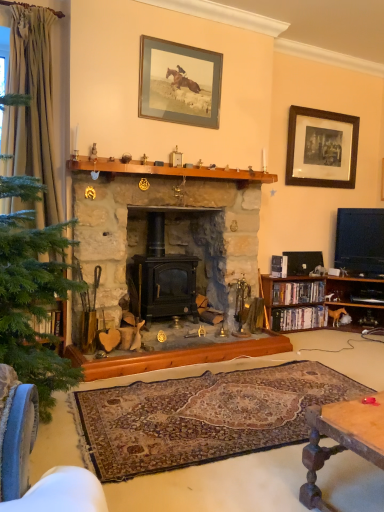
Question: Is black wood picture frame at upper right, which ranks as the first picture frame in right-to-left order, bigger or smaller than black stone fireplace at center?

Choices:
 (A) small
 (B) big

Answer: (A)

Question: Considering the positions of point (342, 120) and point (137, 162), is point (342, 120) closer or farther from the camera than point (137, 162)?

Choices:
 (A) closer
 (B) farther

Answer: (B)

Question: Which object is positioned closest to the hardcover books at right, which appears as the 2th book when ordered from the bottom?

Choices:
 (A) creamy silk curtain at left
 (B) black stone fireplace at center
 (C) black plastic dvds at right, the first book in the bottom-to-top sequence
 (D) matte glass picture frame at upper center, the 1th picture frame from the left
 (E) black wood picture frame at upper right, which ranks as the first picture frame in right-to-left order

Answer: (C)

Question: Which object is positioned closest to the black stone fireplace at center?

Choices:
 (A) wooden bookshelf at right
 (B) matte glass picture frame at upper center, the 1th picture frame from the left
 (C) black wood picture frame at upper right, marked as the second picture frame in a left-to-right arrangement
 (D) hardcover books at right, which appears as the 2th book when ordered from the bottom
 (E) creamy silk curtain at left

Answer: (B)